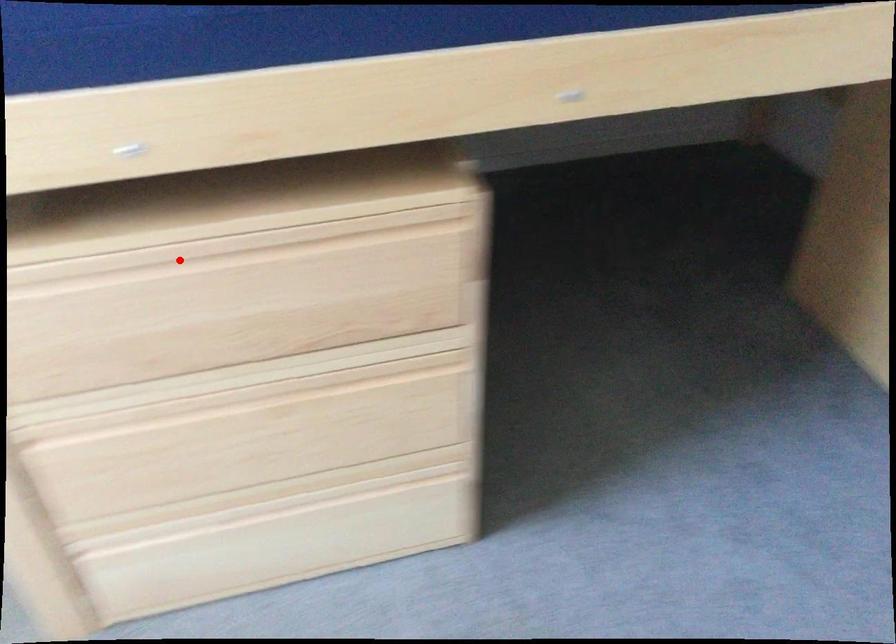
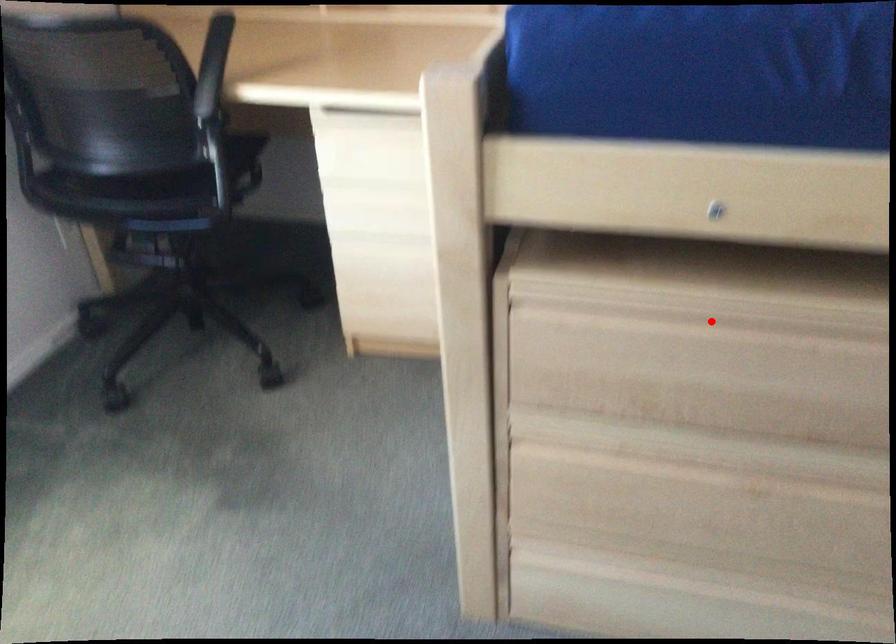
I am providing you with two images of the same scene from different viewpoints. A red point is marked on the first image and another point is marked on the second image. Is the marked point in image1 the same physical position as the marked point in image2?

Yes